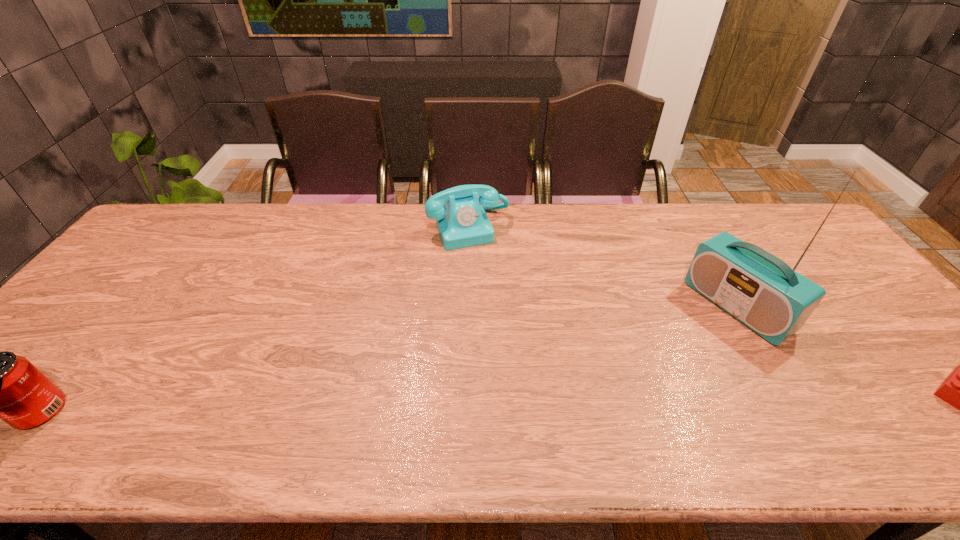
You are a GUI agent. You are given a task and a screenshot of the screen. Output one action in this format:
    pyautogui.click(x=<x>, y=<y>)
    Task: Click on the blank space at the near left corner
    
    Given the screenshot: What is the action you would take?
    pyautogui.click(x=74, y=380)

The width and height of the screenshot is (960, 540). I want to click on vacant space that is in between the radio receiver and the soda can, so click(x=389, y=359).

Find the location of a particular element. This screenshot has height=540, width=960. free space that is in between the radio receiver and the second object from left to right is located at coordinates (603, 268).

The width and height of the screenshot is (960, 540). What are the coordinates of `free area in between the second farthest object and the leftmost object` in the screenshot? It's located at (389, 359).

The width and height of the screenshot is (960, 540). Identify the location of vacant space in between the farthest object and the third nearest object. (603, 268).

Locate an element on the screen. vacant space in between the soda can and the farthest object is located at coordinates (255, 320).

Identify which object is the nearest to the soda can. Please provide its 2D coordinates. Your answer should be formatted as a tuple, i.e. [(x, y)], where the tuple contains the x and y coordinates of a point satisfying the conditions above.

[(462, 222)]

At what (x,y) coordinates should I click in order to perform the action: click on object that is the closest to the leftmost object. Please return your answer as a coordinate pair (x, y). Looking at the image, I should click on point(462,222).